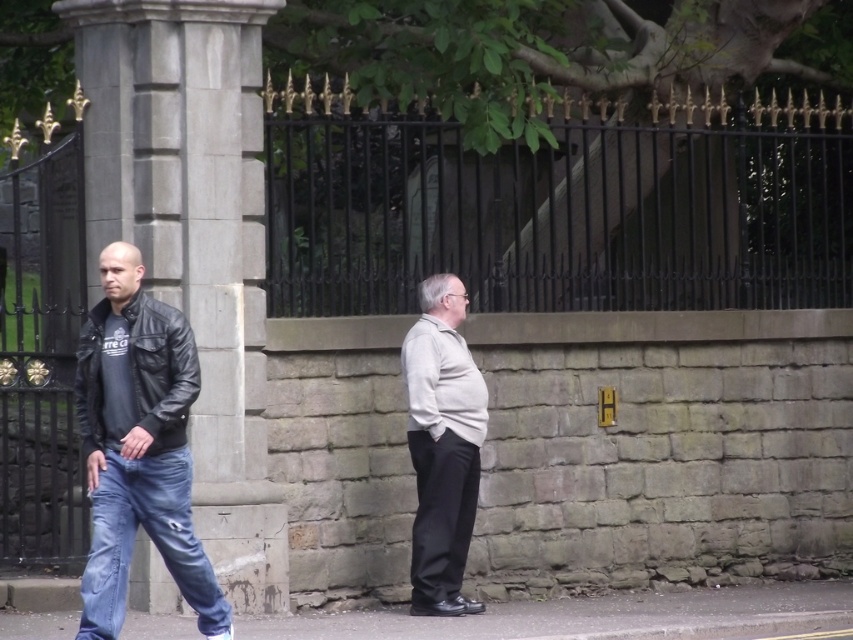
Does leather jacket at left have a smaller size compared to light beige sweater at center?

No.

Which is behind, point (163, 388) or point (469, 401)?

The point (469, 401) is more distant.

Identify the location of leather jacket at left. This screenshot has height=640, width=853. (138, 448).

Does gray stone pillar at center appear over light gray sweater at center?

Yes.

Between point (189, 316) and point (439, 412), which one is positioned behind?

Positioned behind is point (439, 412).

Image resolution: width=853 pixels, height=640 pixels. In order to click on gray stone pillar at center in this screenshot , I will do `click(194, 237)`.

Where is `gray stone pillar at center`? Image resolution: width=853 pixels, height=640 pixels. gray stone pillar at center is located at coordinates (194, 237).

Between point (502, 612) and point (439, 356), which one is positioned behind?

Point (502, 612)

Who is more distant from viewer, (727, 620) or (456, 353)?

The point (456, 353) is more distant.

This screenshot has width=853, height=640. Identify the location of gray asphalt at lower center. (592, 616).